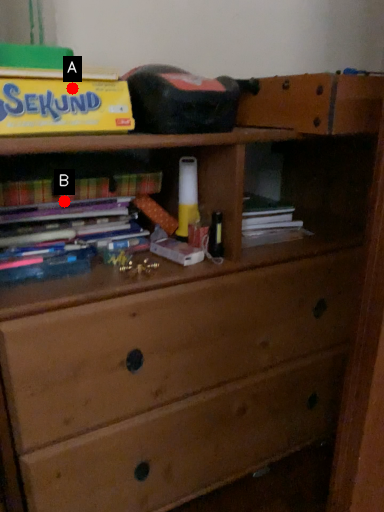
Question: Two points are circled on the image, labeled by A and B beside each circle. Which point appears farthest from the camera in this image?

Choices:
 (A) A is further
 (B) B is further

Answer: (B)